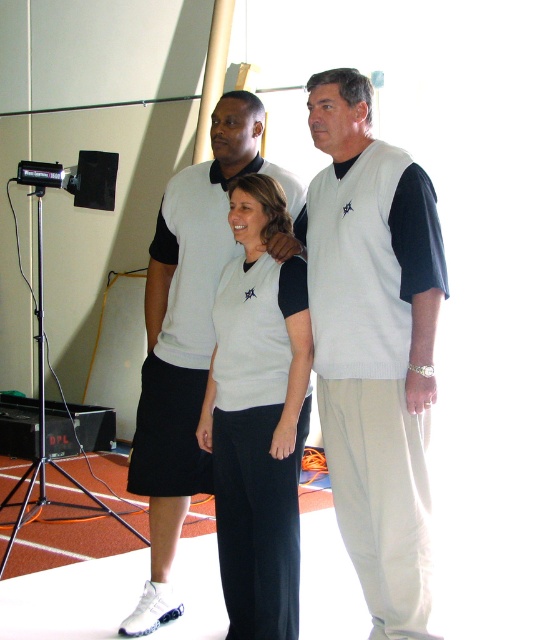
Is white knit vest at center further to camera compared to white knit sweater at center?

No, it is not.

Does white knit vest at center have a greater width compared to white knit sweater at center?

In fact, white knit vest at center might be narrower than white knit sweater at center.

I want to click on white knit vest at center, so click(259, 417).

The height and width of the screenshot is (640, 560). What do you see at coordinates (375, 346) in the screenshot?
I see `white knitted vest at center` at bounding box center [375, 346].

Which is in front, point (427, 250) or point (190, 420)?

Point (427, 250)

The height and width of the screenshot is (640, 560). Describe the element at coordinates (375, 346) in the screenshot. I see `white knitted vest at center` at that location.

I want to click on white knitted vest at center, so click(x=375, y=346).

Describe the element at coordinates (375, 346) in the screenshot. I see `white knitted vest at center` at that location.

Can you confirm if white knitted vest at center is positioned to the right of white knit vest at center?

Correct, you'll find white knitted vest at center to the right of white knit vest at center.

Is point (314, 88) behind point (278, 330)?

No, it is in front of (278, 330).

Where is `white knitted vest at center`? This screenshot has width=560, height=640. white knitted vest at center is located at coordinates 375,346.